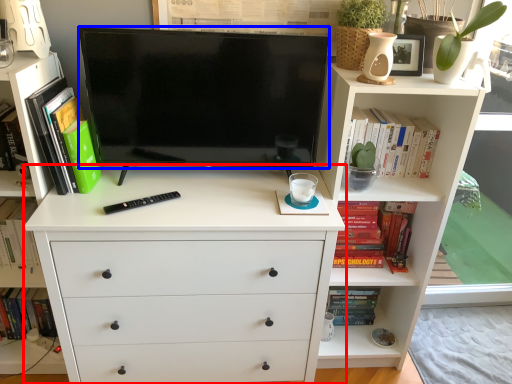
Question: Which object appears farthest to the camera in this image, chest of drawers (highlighted by a red box) or television (highlighted by a blue box)?

Choices:
 (A) chest of drawers
 (B) television

Answer: (B)